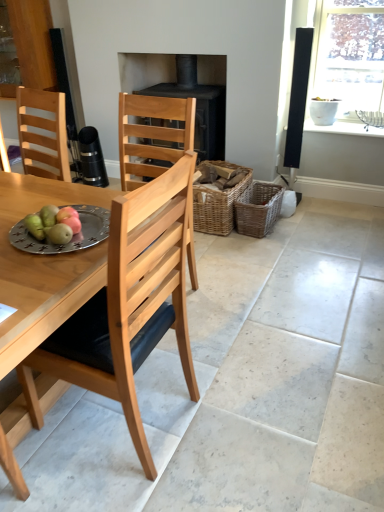
Where is `space that is in front of woven brown basket at center, the 1th basket positioned from the left`? The width and height of the screenshot is (384, 512). space that is in front of woven brown basket at center, the 1th basket positioned from the left is located at coordinates (232, 249).